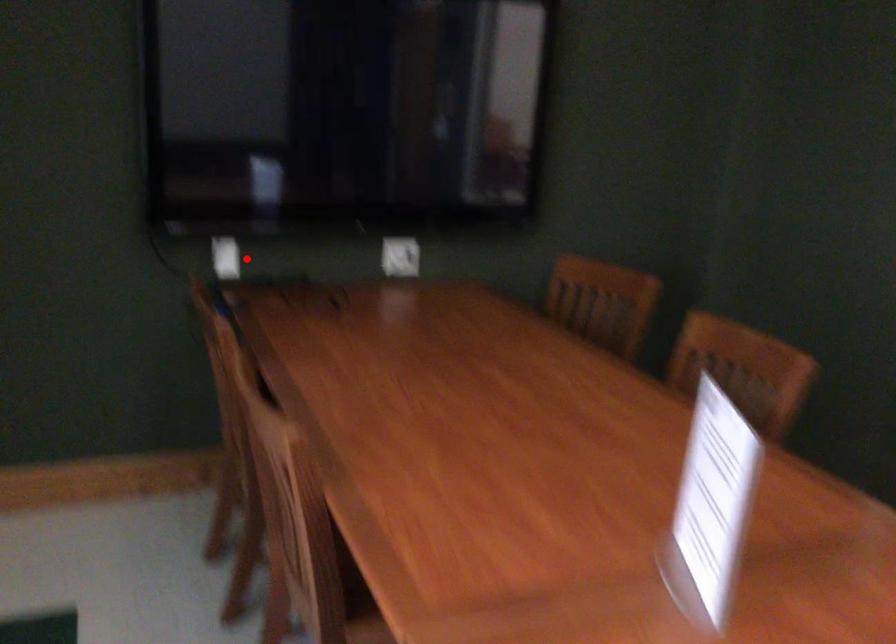
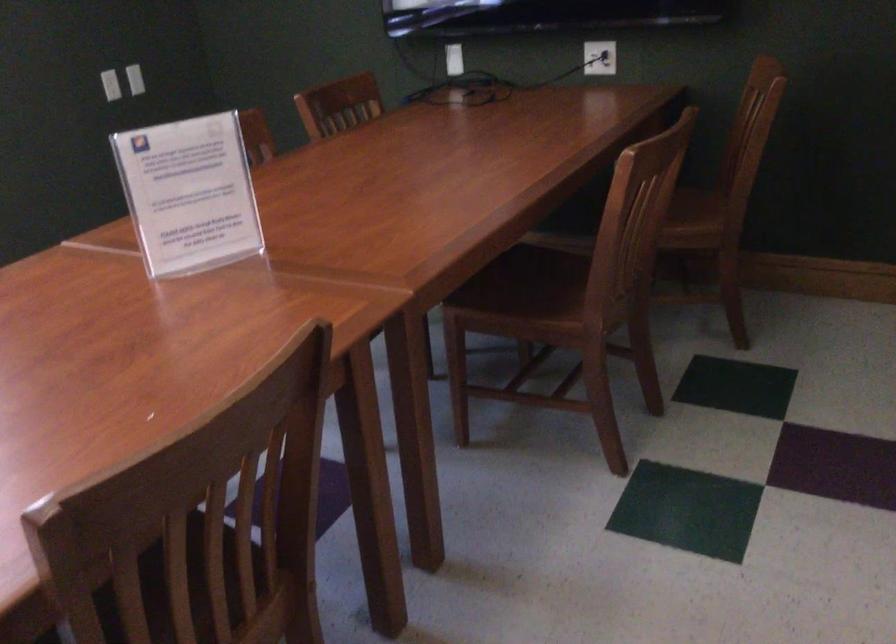
The point at the highlighted location is marked in the first image. Where is the corresponding point in the second image?

(453, 59)